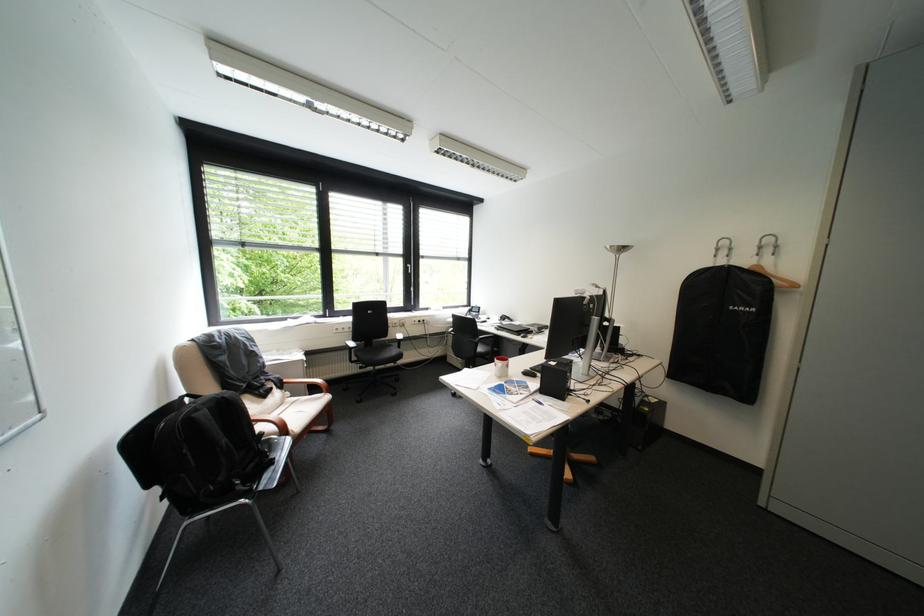
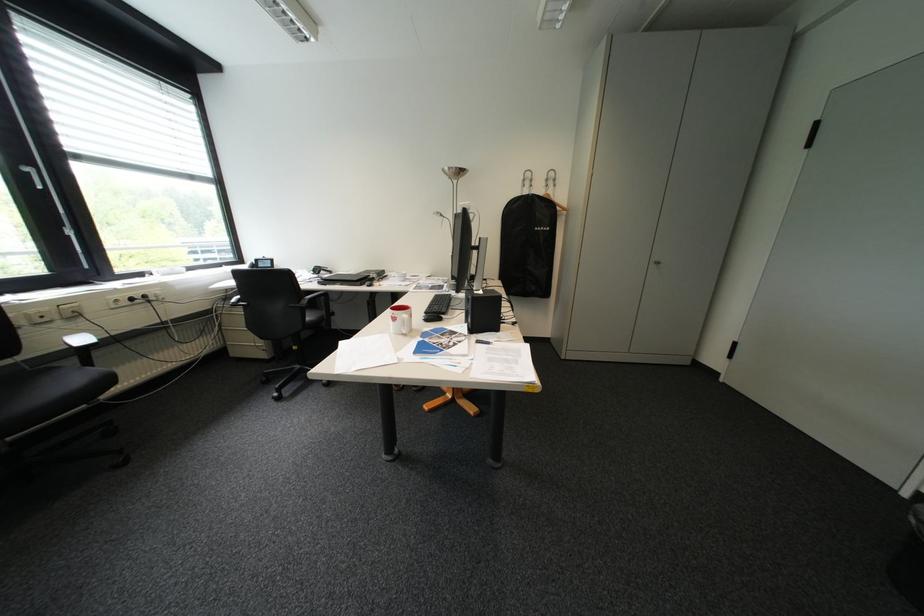
Question: The camera is either moving clockwise (left) or counter-clockwise (right) around the object. The first image is from the beginning of the video and the second image is from the end. Is the camera moving left or right when shooting the video?

Choices:
 (A) Left
 (B) Right

Answer: (A)